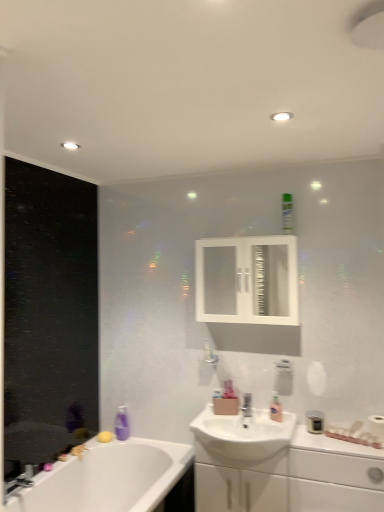
You are a GUI agent. You are given a task and a screenshot of the screen. Output one action in this format:
    pyautogui.click(x=<x>, y=<y>)
    Task: Click on the free space in front of pink glossy lotion at sink, marked as the third toiletry in a right-to-left arrangement
    The image size is (384, 512).
    Given the screenshot: What is the action you would take?
    pyautogui.click(x=287, y=422)